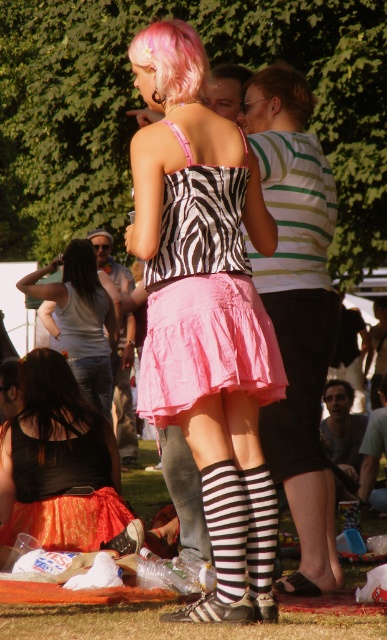
You are a photographer at the event and need to capture a wide shot of the scene. The pink satin skirt at center and the black shiny hair at lower left are both in your frame. Which object should you focus on first if you want to ensure the larger object is in focus?

The pink satin skirt at center should be focused on first because its width is larger than the black shiny hair at lower left, making it the larger object in the scene.

You are a photographer at the festival. You want to take a photo that includes both the zebra print tank top at center and the black shiny hair at lower left. What is the minimum distance you need to move backward to ensure both objects are in frame?

The zebra print tank top at center and the black shiny hair at lower left are 6.76 meters apart from each other. To include both in the frame, the photographer must ensure their camera has a field of view wide enough to capture this distance. If the current camera setup cannot accommodate this, moving backward would increase the field of view, allowing both objects to be in frame. The exact distance required depends on the camera lens and sensor size, but the minimum backward movement needed would be such a